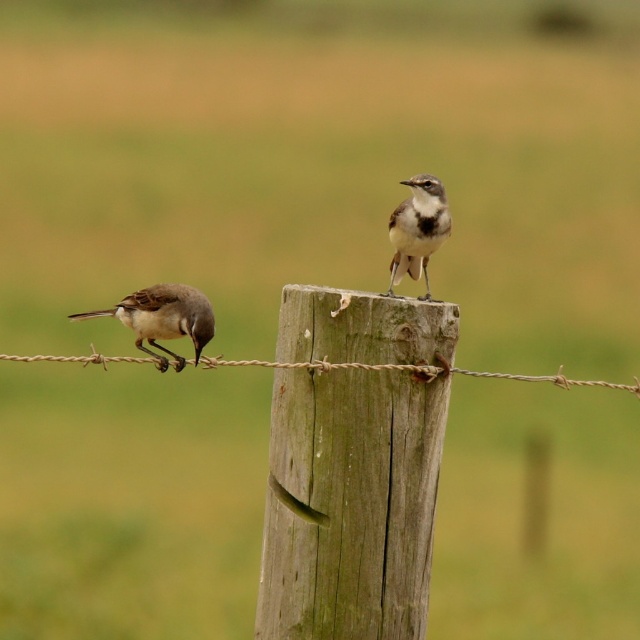
Question: Where is brown rope at center located in relation to gray speckled bird at upper center in the image?

Choices:
 (A) right
 (B) left

Answer: (B)

Question: Which is farther from the brown rope at center?

Choices:
 (A) weathered wood post at center
 (B) gray speckled bird at upper center

Answer: (B)

Question: Does weathered wood post at center lie in front of brown rope at center?

Choices:
 (A) no
 (B) yes

Answer: (A)

Question: Which point is farther from the camera taking this photo?

Choices:
 (A) (131, 320)
 (B) (570, 380)
 (C) (422, 240)

Answer: (C)

Question: Among these objects, which one is nearest to the camera?

Choices:
 (A) brown speckled feathers at left
 (B) weathered wood post at center

Answer: (B)

Question: Does brown rope at center appear over gray speckled bird at upper center?

Choices:
 (A) no
 (B) yes

Answer: (A)